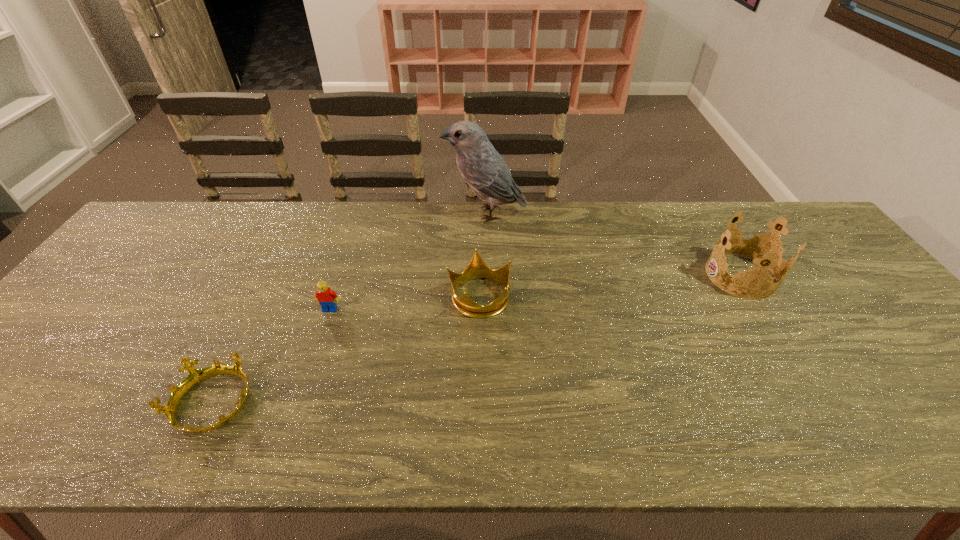
I want to click on object that is the nearest to the parrot, so click(x=476, y=268).

Find the location of a particular element. object that ranks as the second closest to the second crown from right to left is located at coordinates (326, 297).

Identify which crown is the closest to the rightmost crown. Please provide its 2D coordinates. Your answer should be formatted as a tuple, i.e. [(x, y)], where the tuple contains the x and y coordinates of a point satisfying the conditions above.

[(476, 268)]

Identify the location of the second closest crown to the second crown from right to left. This screenshot has height=540, width=960. (756, 249).

Where is `free region that satisfies the following two spatial constraints: 1. on the front-facing side of the tallest object; 2. on the back side of the rightmost crown`? The height and width of the screenshot is (540, 960). free region that satisfies the following two spatial constraints: 1. on the front-facing side of the tallest object; 2. on the back side of the rightmost crown is located at coordinates (487, 275).

This screenshot has height=540, width=960. In order to click on free space that satisfies the following two spatial constraints: 1. on the front-facing side of the tallest object; 2. on the front side of the second tallest crown in this screenshot , I will do `click(487, 296)`.

This screenshot has height=540, width=960. In order to click on vacant region that satisfies the following two spatial constraints: 1. on the front-facing side of the rightmost crown; 2. on the left side of the farthest object in this screenshot , I will do `click(487, 275)`.

Locate an element on the screen. The width and height of the screenshot is (960, 540). vacant area in the image that satisfies the following two spatial constraints: 1. on the front-facing side of the rightmost crown; 2. on the left side of the farthest object is located at coordinates (487, 275).